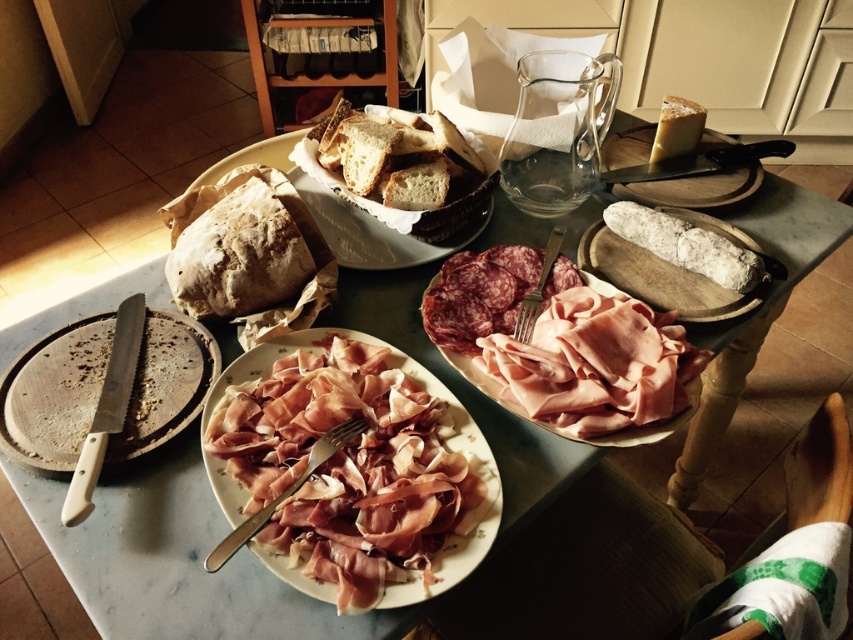
Does pink glossy ham at center lie behind white wooden board at upper right?

No, pink glossy ham at center is closer to the viewer.

Between pink glossy ham at center and white wooden board at upper right, which one appears on the left side from the viewer's perspective?

pink glossy ham at center

Who is more forward, (405,518) or (604,145)?

Point (405,518) is more forward.

Where is `pink glossy ham at center`? The image size is (853, 640). pink glossy ham at center is located at coordinates (352, 468).

Between point (340, 212) and point (706, 186), which one is positioned in front?

Positioned in front is point (340, 212).

Is baked clay bread at center bigger than white wooden board at upper right?

Correct, baked clay bread at center is larger in size than white wooden board at upper right.

You are a GUI agent. You are given a task and a screenshot of the screen. Output one action in this format:
    pyautogui.click(x=<x>, y=<y>)
    Task: Click on the baked clay bread at center
    This screenshot has width=853, height=640.
    Given the screenshot: What is the action you would take?
    pyautogui.click(x=349, y=212)

Between pink glossy ham at center and pink glossy meat at center, which one has less height?

pink glossy meat at center

Is the position of pink glossy ham at center more distant than that of pink glossy meat at center?

No, pink glossy ham at center is in front of pink glossy meat at center.

Who is more forward, [312,364] or [675,417]?

Point [675,417] is more forward.

At what (x,y) coordinates should I click in order to perform the action: click on pink glossy ham at center. Please return your answer as a coordinate pair (x, y). Image resolution: width=853 pixels, height=640 pixels. Looking at the image, I should click on (352, 468).